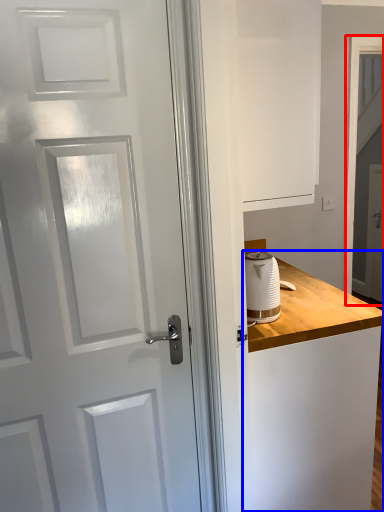
Question: Among these objects, which one is farthest to the camera, screen door (highlighted by a red box) or counter (highlighted by a blue box)?

Choices:
 (A) screen door
 (B) counter

Answer: (A)